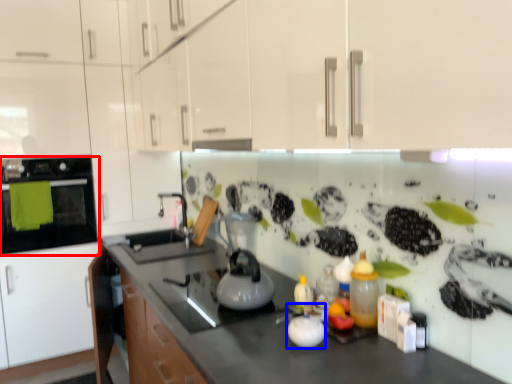
Question: Among these objects, which one is farthest to the camera, home appliance (highlighted by a red box) or appliance (highlighted by a blue box)?

Choices:
 (A) home appliance
 (B) appliance

Answer: (A)